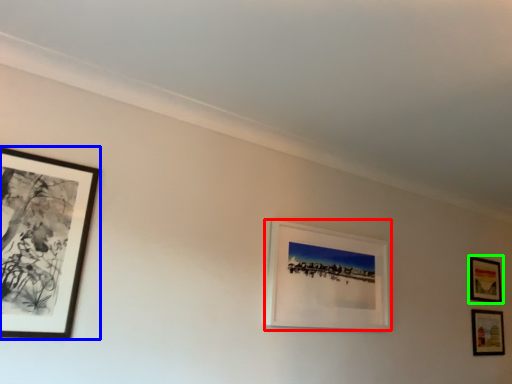
Question: Which is farther away from picture frame (highlighted by a red box)? picture frame (highlighted by a blue box) or picture frame (highlighted by a green box)?

Choices:
 (A) picture frame
 (B) picture frame

Answer: (B)